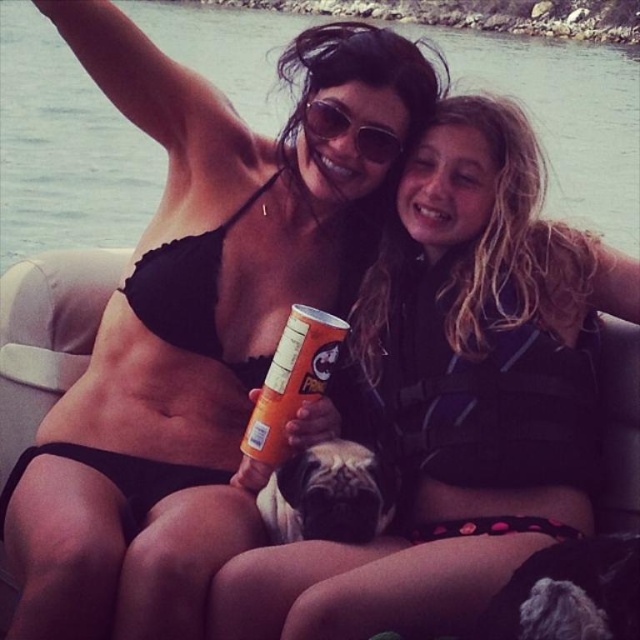
Question: Does black matte bikini top at upper center have a greater width compared to orange matte can at center?

Choices:
 (A) no
 (B) yes

Answer: (B)

Question: Does black bikini at center lie behind orange matte can at center?

Choices:
 (A) yes
 (B) no

Answer: (B)

Question: Which object appears closest to the camera in this image?

Choices:
 (A) pug fur at center
 (B) matte black bikini at center
 (C) sunglasses at center

Answer: (A)

Question: Which object is farther from the camera taking this photo?

Choices:
 (A) pug fur at center
 (B) orange matte can at center
 (C) fluffy gray dog at lower right
 (D) black matte bikini top at upper center

Answer: (D)

Question: Which point is closer to the camera?

Choices:
 (A) (324, 93)
 (B) (307, 506)
 (C) (291, 404)

Answer: (B)

Question: Does orange matte can at center appear on the right side of sunglasses at center?

Choices:
 (A) no
 (B) yes

Answer: (A)